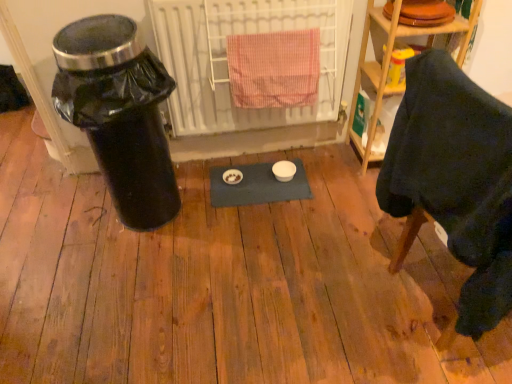
This screenshot has height=384, width=512. Describe the element at coordinates (227, 62) in the screenshot. I see `white metal radiator at center` at that location.

The height and width of the screenshot is (384, 512). I want to click on black plastic trash can at left, so click(x=119, y=113).

The height and width of the screenshot is (384, 512). What do you see at coordinates (274, 69) in the screenshot?
I see `pink checkered towel at center` at bounding box center [274, 69].

Where is `wooden shelf at upper right`? The height and width of the screenshot is (384, 512). wooden shelf at upper right is located at coordinates (389, 63).

From the image's perspective, which is above, dark fabric chair at lower right or pink checkered towel at center?

From the image's view, pink checkered towel at center is above.

Between dark fabric chair at lower right and pink checkered towel at center, which one has larger size?

With larger size is dark fabric chair at lower right.

Which is more to the left, dark fabric chair at lower right or pink checkered towel at center?

pink checkered towel at center.

From a real-world perspective, does dark fabric chair at lower right stand above pink checkered towel at center?

No, from a real-world perspective, dark fabric chair at lower right is not on top of pink checkered towel at center.

Consider the image. Considering the relative sizes of black plastic trash can at left and white metal radiator at center in the image provided, is black plastic trash can at left taller than white metal radiator at center?

Yes.

Considering the points (93, 116) and (208, 45), which point is behind, point (93, 116) or point (208, 45)?

Positioned behind is point (208, 45).

From a real-world perspective, who is located lower, black plastic trash can at left or white metal radiator at center?

black plastic trash can at left.

Considering the sizes of objects wooden shelf at upper right and white metal radiator at center in the image provided, who is thinner, wooden shelf at upper right or white metal radiator at center?

Thinner between the two is white metal radiator at center.

At what (x,y) coordinates should I click in order to perform the action: click on radiator above the wooden shelf at upper right (from the image's perspective). Please return your answer as a coordinate pair (x, y). This screenshot has height=384, width=512. Looking at the image, I should click on (227, 62).

Looking at this image, from the image's perspective, is wooden shelf at upper right above or below white metal radiator at center?

wooden shelf at upper right is situated lower than white metal radiator at center in the image.

Between dark fabric chair at lower right and white metal radiator at center, which one is positioned in front?

dark fabric chair at lower right is closer to the camera.

Is white metal radiator at center at the back of dark fabric chair at lower right?

No, white metal radiator at center is not at the back of dark fabric chair at lower right.

Is dark fabric chair at lower right not close to white metal radiator at center?

No.

From a real-world perspective, who is located lower, dark fabric chair at lower right or white metal radiator at center?

In real-world perspective, dark fabric chair at lower right is lower.

From a real-world perspective, does pink checkered towel at center sit lower than dark fabric chair at lower right?

No, from a real-world perspective, pink checkered towel at center is not below dark fabric chair at lower right.

Based on the photo, who is taller, pink checkered towel at center or dark fabric chair at lower right?

dark fabric chair at lower right.

Does point (269, 97) lie behind point (509, 194)?

That is True.

Is dark fabric chair at lower right a part of pink checkered towel at center?

No, dark fabric chair at lower right is not inside pink checkered towel at center.

What's the angular difference between wooden shelf at upper right and black plastic trash can at left's facing directions?

They differ by 2.05 degrees in their facing directions.

Which of these two, wooden shelf at upper right or black plastic trash can at left, is thinner?

With smaller width is wooden shelf at upper right.

Considering the relative sizes of wooden shelf at upper right and black plastic trash can at left in the image provided, is wooden shelf at upper right shorter than black plastic trash can at left?

Indeed, wooden shelf at upper right has a lesser height compared to black plastic trash can at left.

Is point (432, 35) closer to camera compared to point (124, 104)?

No, (432, 35) is behind (124, 104).

Are pink checkered towel at center and black plastic trash can at left making contact?

No, pink checkered towel at center is not beside black plastic trash can at left.

Is pink checkered towel at center at the left side of black plastic trash can at left?

No.

Find the location of a particular element. The height and width of the screenshot is (384, 512). waste container that is on the left side of pink checkered towel at center is located at coordinates (119, 113).

Considering the sizes of objects pink checkered towel at center and black plastic trash can at left in the image provided, who is thinner, pink checkered towel at center or black plastic trash can at left?

Thinner between the two is pink checkered towel at center.

Locate an element on the screen. furniture in front of the pink checkered towel at center is located at coordinates (456, 179).

What are the coordinates of `radiator located above the black plastic trash can at left (from a real-world perspective)` in the screenshot? It's located at (227, 62).

When comparing their distances from wooden shelf at upper right, does black plastic trash can at left or pink checkered towel at center seem closer?

pink checkered towel at center lies closer to wooden shelf at upper right than the other object.

Looking at the image, which one is located further to pink checkered towel at center, white metal radiator at center or wooden shelf at upper right?

The object further to pink checkered towel at center is wooden shelf at upper right.

Estimate the real-world distances between objects in this image. Which object is closer to pink checkered towel at center, wooden shelf at upper right or dark fabric chair at lower right?

Among the two, wooden shelf at upper right is located nearer to pink checkered towel at center.

Looking at the image, which one is located further to pink checkered towel at center, dark fabric chair at lower right or white metal radiator at center?

The object further to pink checkered towel at center is dark fabric chair at lower right.

Estimate the real-world distances between objects in this image. Which object is closer to pink checkered towel at center, black plastic trash can at left or wooden shelf at upper right?

wooden shelf at upper right lies closer to pink checkered towel at center than the other object.

In the scene shown: Which object lies nearer to the anchor point black plastic trash can at left, dark fabric chair at lower right or wooden shelf at upper right?

The object closer to black plastic trash can at left is dark fabric chair at lower right.

Considering their positions, is dark fabric chair at lower right positioned closer to black plastic trash can at left than white metal radiator at center?

white metal radiator at center is positioned closer to the anchor black plastic trash can at left.

Estimate the real-world distances between objects in this image. Which object is closer to wooden shelf at upper right, black plastic trash can at left or dark fabric chair at lower right?

The object closer to wooden shelf at upper right is dark fabric chair at lower right.

Image resolution: width=512 pixels, height=384 pixels. Identify the location of radiator between black plastic trash can at left and dark fabric chair at lower right in the horizontal direction. (227, 62).

This screenshot has height=384, width=512. I want to click on shelf located between dark fabric chair at lower right and white metal radiator at center in the depth direction, so click(389, 63).

Locate an element on the screen. bath towel between dark fabric chair at lower right and white metal radiator at center in the front-back direction is located at coordinates (274, 69).

Where is `radiator located between black plastic trash can at left and wooden shelf at upper right in the left-right direction`? radiator located between black plastic trash can at left and wooden shelf at upper right in the left-right direction is located at coordinates (227, 62).